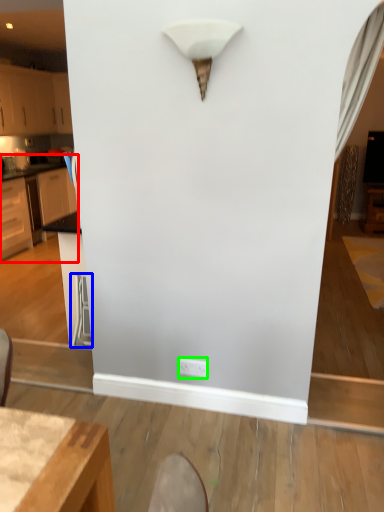
Question: Considering the real-world distances, which object is closest to cabinetry (highlighted by a red box)? swivel chair (highlighted by a blue box) or electric outlet (highlighted by a green box).

Choices:
 (A) swivel chair
 (B) electric outlet

Answer: (A)